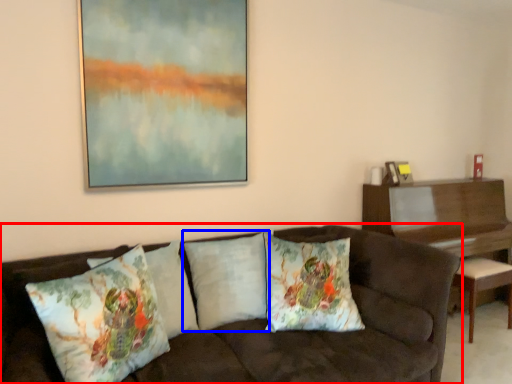
Question: Among these objects, which one is farthest to the camera, studio couch (highlighted by a red box) or pillow (highlighted by a blue box)?

Choices:
 (A) studio couch
 (B) pillow

Answer: (B)